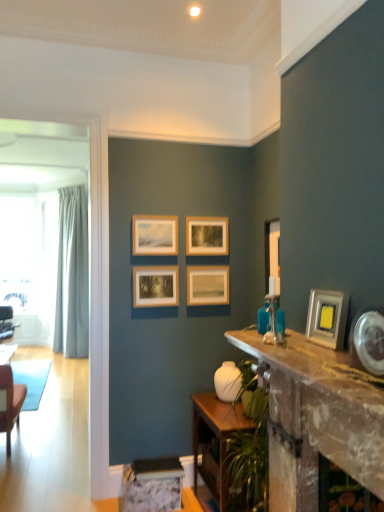
Question: Does white glossy vase at center have a greater height compared to wooden picture frame at upper center, acting as the sixth picture frame starting from the front?

Choices:
 (A) no
 (B) yes

Answer: (A)

Question: Is wooden picture frame at upper center, which is the first picture frame from back to front, surrounded by white glossy vase at center?

Choices:
 (A) no
 (B) yes

Answer: (A)

Question: Does white glossy vase at center appear on the left side of wooden picture frame at upper center, acting as the sixth picture frame starting from the front?

Choices:
 (A) no
 (B) yes

Answer: (A)

Question: Considering the relative sizes of white glossy vase at center and wooden picture frame at upper center, acting as the sixth picture frame starting from the front, in the image provided, is white glossy vase at center shorter than wooden picture frame at upper center, acting as the sixth picture frame starting from the front,?

Choices:
 (A) no
 (B) yes

Answer: (B)

Question: Can you confirm if white glossy vase at center is positioned to the right of wooden picture frame at upper center, which is the first picture frame from back to front?

Choices:
 (A) no
 (B) yes

Answer: (B)

Question: Does white glossy vase at center lie behind wooden picture frame at upper center, acting as the sixth picture frame starting from the front?

Choices:
 (A) yes
 (B) no

Answer: (B)

Question: Could you tell me if wooden picture frame at upper center, the fourth picture frame in the front-to-back sequence, is turned towards wooden picture frame at upper center, which is the first picture frame from back to front?

Choices:
 (A) no
 (B) yes

Answer: (A)

Question: Does wooden picture frame at upper center, which is the third picture frame from back to front, touch wooden picture frame at upper center, acting as the sixth picture frame starting from the front?

Choices:
 (A) no
 (B) yes

Answer: (A)

Question: Are wooden picture frame at upper center, the fourth picture frame in the front-to-back sequence, and wooden picture frame at upper center, which is the first picture frame from back to front, located far from each other?

Choices:
 (A) no
 (B) yes

Answer: (A)

Question: Does wooden picture frame at upper center, the fourth picture frame in the front-to-back sequence, have a greater width compared to wooden picture frame at upper center, which is the first picture frame from back to front?

Choices:
 (A) no
 (B) yes

Answer: (B)

Question: Does wooden picture frame at upper center, the fourth picture frame in the front-to-back sequence, have a lesser height compared to wooden picture frame at upper center, acting as the sixth picture frame starting from the front?

Choices:
 (A) yes
 (B) no

Answer: (B)

Question: From a real-world perspective, is wooden picture frame at upper center, which is the third picture frame from back to front, beneath wooden picture frame at upper center, which is the first picture frame from back to front?

Choices:
 (A) yes
 (B) no

Answer: (B)

Question: Could you tell me if metallic silver picture frame at right, positioned as the 1th picture frame in front-to-back order, is turned towards wooden table at lower center, which is counted as the 1th table, starting from the back?

Choices:
 (A) yes
 (B) no

Answer: (B)